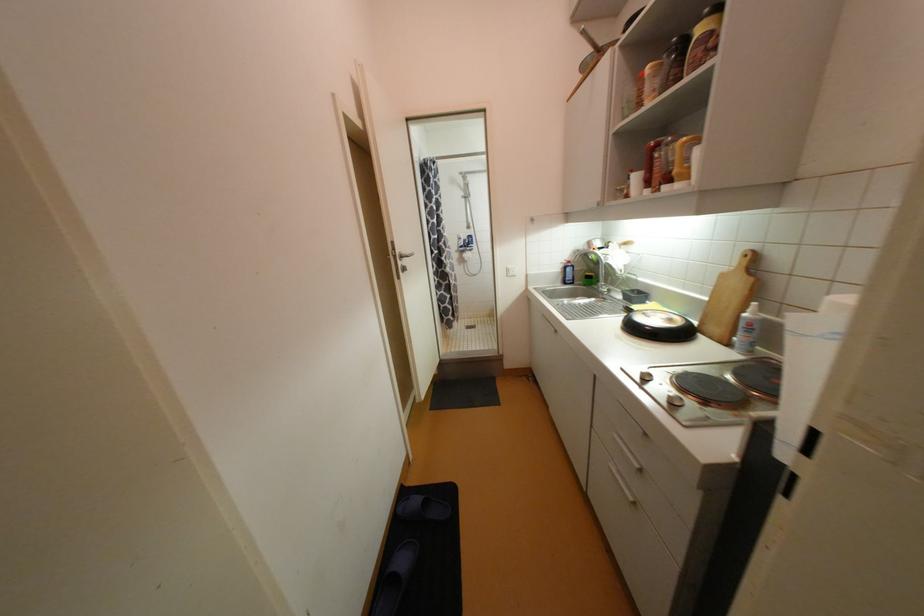
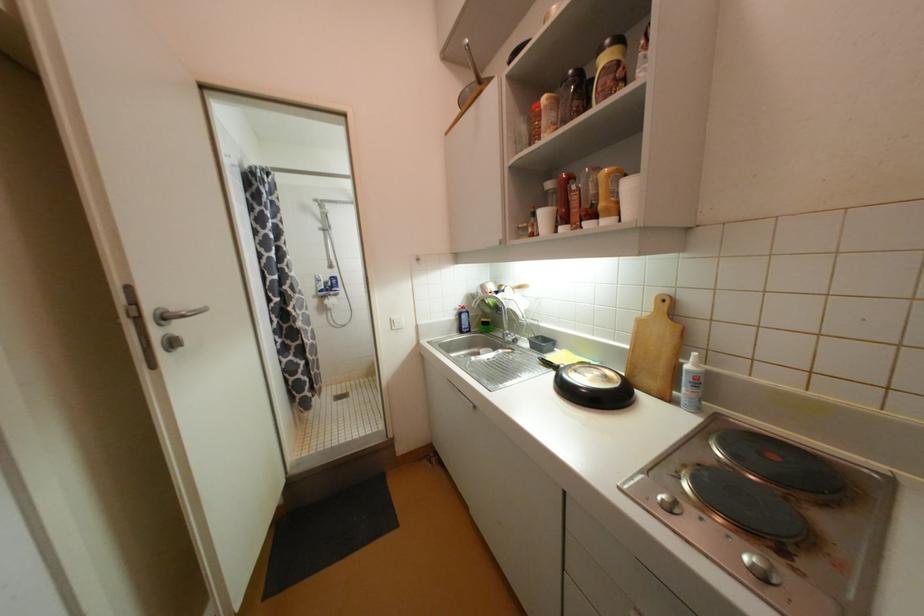
Where in the second image is the point corresponding to pixel 712 299 from the first image?

(633, 346)